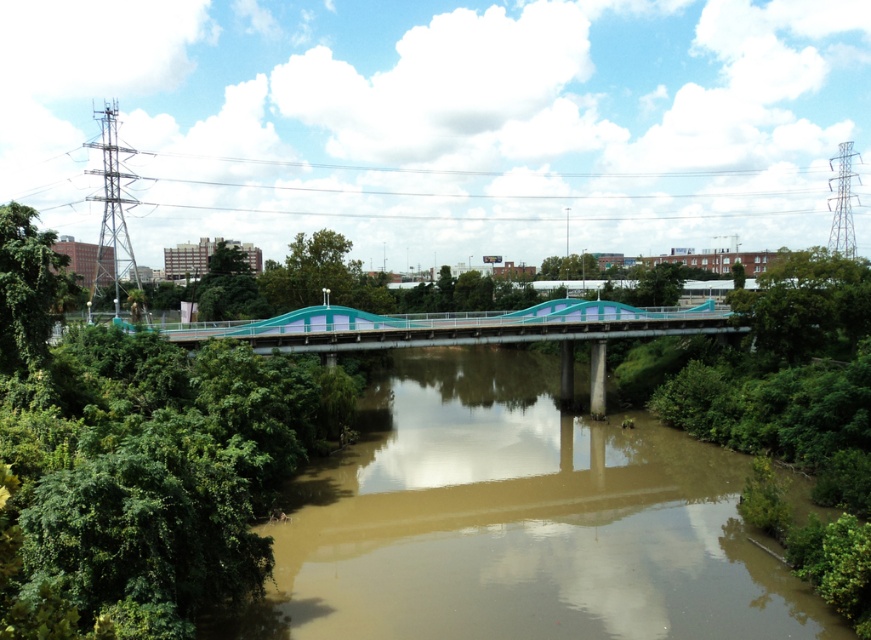
Does brown muddy water at center have a lesser width compared to green leafy tree at left?

No.

Between brown muddy water at center and green leafy tree at left, which one is positioned higher?

green leafy tree at left

This screenshot has height=640, width=871. I want to click on brown muddy water at center, so click(517, 522).

Image resolution: width=871 pixels, height=640 pixels. Find the location of `brown muddy water at center`. brown muddy water at center is located at coordinates (517, 522).

Describe the element at coordinates (29, 289) in the screenshot. This screenshot has width=871, height=640. I see `green leafy tree at left` at that location.

What do you see at coordinates (29, 289) in the screenshot? I see `green leafy tree at left` at bounding box center [29, 289].

The width and height of the screenshot is (871, 640). I want to click on green leafy tree at left, so pyautogui.click(x=29, y=289).

Can you confirm if brown muddy water at center is wider than green leafy tree at center?

Yes, brown muddy water at center is wider than green leafy tree at center.

Between brown muddy water at center and green leafy tree at center, which one has more height?

With more height is green leafy tree at center.

Identify the location of brown muddy water at center. (517, 522).